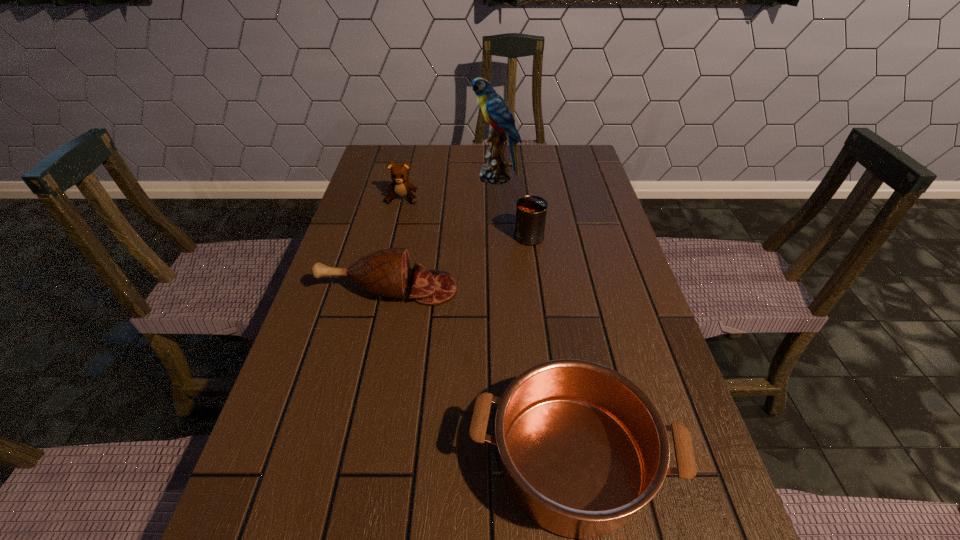
Locate an element on the screen. vacant space located 0.050m on the front-facing side of the teddy bear is located at coordinates (398, 215).

Find the location of a particular element. vacant space located 0.310m at the sliced end of the fourth farthest object is located at coordinates (585, 289).

The width and height of the screenshot is (960, 540). I want to click on object at the far edge, so 494,109.

Find the location of a particular element. This screenshot has height=540, width=960. teddy bear present at the left edge is located at coordinates point(400,187).

Where is `ham situated at the left edge`? This screenshot has width=960, height=540. ham situated at the left edge is located at coordinates (386, 272).

You are a GUI agent. You are given a task and a screenshot of the screen. Output one action in this format:
    pyautogui.click(x=<x>, y=<y>)
    Task: Click on the free region at the far edge of the desktop
    
    Given the screenshot: What is the action you would take?
    pyautogui.click(x=443, y=148)

What are the coordinates of `vacant space at the left edge` in the screenshot? It's located at (317, 488).

The image size is (960, 540). Identify the location of vacant space at the right edge. (595, 190).

This screenshot has height=540, width=960. In order to click on blank space at the far left corner in this screenshot , I will do `click(411, 151)`.

The height and width of the screenshot is (540, 960). Find the location of `vacant region at the far right corner of the desktop`. vacant region at the far right corner of the desktop is located at coordinates (553, 156).